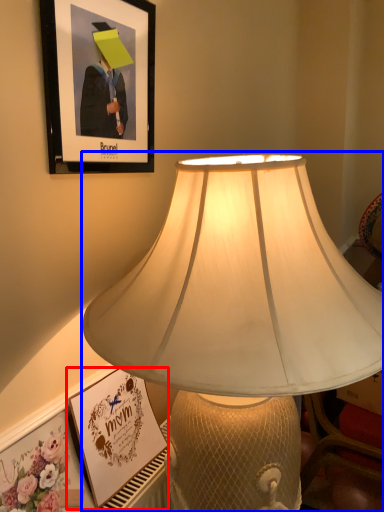
Question: Which of the following is the farthest to the observer, picture frame (highlighted by a red box) or lamp (highlighted by a blue box)?

Choices:
 (A) picture frame
 (B) lamp

Answer: (A)